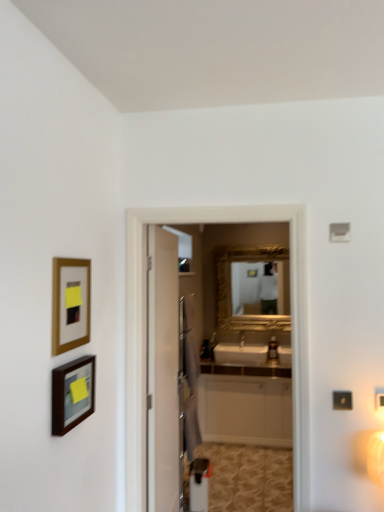
The height and width of the screenshot is (512, 384). What do you see at coordinates (72, 394) in the screenshot? I see `matte black picture frame at lower left, arranged as the first picture frame when ordered from the bottom` at bounding box center [72, 394].

What is the approximate height of white glossy cabinet at center?

The height of white glossy cabinet at center is 31.04 inches.

You are a GUI agent. You are given a task and a screenshot of the screen. Output one action in this format:
    pyautogui.click(x=<x>, y=<y>)
    Task: Click on the white glossy screen door at center
    This screenshot has width=384, height=512.
    Given the screenshot: What is the action you would take?
    pyautogui.click(x=142, y=331)

From a real-world perspective, between white glossy cabinet at center and gold-framed picture at left, which is counted as the 1th picture frame, starting from the top, who is vertically higher?

From a 3D spatial view, gold-framed picture at left, which is counted as the 1th picture frame, starting from the top, is above.

Considering the points (250, 429) and (54, 344), which point is behind, point (250, 429) or point (54, 344)?

The point (250, 429) is farther from the camera.

Is white glossy cabinet at center in contact with gold-framed picture at left, which is counted as the 2th picture frame, starting from the bottom?

There is a gap between white glossy cabinet at center and gold-framed picture at left, which is counted as the 2th picture frame, starting from the bottom.

At what (x,y) coordinates should I click in order to perform the action: click on picture frame that is the 2nd object above the white glossy cabinet at center (from a real-world perspective). Please return your answer as a coordinate pair (x, y). Image resolution: width=384 pixels, height=512 pixels. Looking at the image, I should click on (70, 304).

Would you say white glossy screen door at center is a long distance from white glossy cabinet at center?

white glossy screen door at center is positioned a significant distance from white glossy cabinet at center.

Is white glossy screen door at center oriented away from white glossy cabinet at center?

Correct, white glossy screen door at center is looking away from white glossy cabinet at center.

Can you confirm if white glossy screen door at center is positioned to the left of white glossy cabinet at center?

Correct, you'll find white glossy screen door at center to the left of white glossy cabinet at center.

From a real-world perspective, is white glossy cabinet at center positioned above or below matte black picture frame at lower left, which ranks as the 2th picture frame in top-to-bottom order?

white glossy cabinet at center is situated lower than matte black picture frame at lower left, which ranks as the 2th picture frame in top-to-bottom order, in the real world.

Choose the correct answer: Is white glossy cabinet at center inside matte black picture frame at lower left, arranged as the first picture frame when ordered from the bottom, or outside it?

white glossy cabinet at center cannot be found inside matte black picture frame at lower left, arranged as the first picture frame when ordered from the bottom.

Which object is wider, white glossy cabinet at center or matte black picture frame at lower left, arranged as the first picture frame when ordered from the bottom?

With larger width is white glossy cabinet at center.

Considering the positions of objects white glossy cabinet at center and matte black picture frame at lower left, arranged as the first picture frame when ordered from the bottom, in the image provided, who is more to the right, white glossy cabinet at center or matte black picture frame at lower left, arranged as the first picture frame when ordered from the bottom,?

From the viewer's perspective, white glossy cabinet at center appears more on the right side.

Consider the image. Can you confirm if matte black picture frame at lower left, which ranks as the 2th picture frame in top-to-bottom order, is taller than white glossy cabinet at center?

In fact, matte black picture frame at lower left, which ranks as the 2th picture frame in top-to-bottom order, may be shorter than white glossy cabinet at center.

Considering the relative sizes of matte black picture frame at lower left, which ranks as the 2th picture frame in top-to-bottom order, and white glossy cabinet at center in the image provided, is matte black picture frame at lower left, which ranks as the 2th picture frame in top-to-bottom order, bigger than white glossy cabinet at center?

No.

Is point (82, 367) less distant than point (213, 393)?

Yes, point (82, 367) is closer to viewer.

From a real-world perspective, is matte black picture frame at lower left, which ranks as the 2th picture frame in top-to-bottom order, over white glossy cabinet at center?

Indeed, from a real-world perspective, matte black picture frame at lower left, which ranks as the 2th picture frame in top-to-bottom order, stands above white glossy cabinet at center.

Can you confirm if matte black picture frame at lower left, arranged as the first picture frame when ordered from the bottom, is bigger than gold-framed picture at left, which is counted as the 1th picture frame, starting from the top?

Yes, matte black picture frame at lower left, arranged as the first picture frame when ordered from the bottom, is bigger than gold-framed picture at left, which is counted as the 1th picture frame, starting from the top.

What's the angular difference between matte black picture frame at lower left, which ranks as the 2th picture frame in top-to-bottom order, and gold-framed picture at left, which is counted as the 1th picture frame, starting from the top,'s facing directions?

The angular difference between matte black picture frame at lower left, which ranks as the 2th picture frame in top-to-bottom order, and gold-framed picture at left, which is counted as the 1th picture frame, starting from the top, is 0.734 degrees.

Can you confirm if matte black picture frame at lower left, which ranks as the 2th picture frame in top-to-bottom order, is wider than gold-framed picture at left, which is counted as the 2th picture frame, starting from the bottom?

Correct, the width of matte black picture frame at lower left, which ranks as the 2th picture frame in top-to-bottom order, exceeds that of gold-framed picture at left, which is counted as the 2th picture frame, starting from the bottom.

Can you confirm if gold-framed picture at left, which is counted as the 2th picture frame, starting from the bottom, is shorter than white glossy screen door at center?

Yes, gold-framed picture at left, which is counted as the 2th picture frame, starting from the bottom, is shorter than white glossy screen door at center.

How many degrees apart are the facing directions of gold-framed picture at left, which is counted as the 1th picture frame, starting from the top, and white glossy screen door at center?

The angle between the facing direction of gold-framed picture at left, which is counted as the 1th picture frame, starting from the top, and the facing direction of white glossy screen door at center is 90.7 degrees.

Consider the image. Is gold-framed picture at left, which is counted as the 2th picture frame, starting from the bottom, far from white glossy screen door at center?

gold-framed picture at left, which is counted as the 2th picture frame, starting from the bottom, is actually quite close to white glossy screen door at center.

Which object is thinner, gold-framed picture at left, which is counted as the 2th picture frame, starting from the bottom, or white glossy screen door at center?

gold-framed picture at left, which is counted as the 2th picture frame, starting from the bottom.

Based on the photo, considering the relative sizes of gold-framed picture at left, which is counted as the 2th picture frame, starting from the bottom, and matte black picture frame at lower left, which ranks as the 2th picture frame in top-to-bottom order, in the image provided, is gold-framed picture at left, which is counted as the 2th picture frame, starting from the bottom, shorter than matte black picture frame at lower left, which ranks as the 2th picture frame in top-to-bottom order,?

No.

Is gold-framed picture at left, which is counted as the 2th picture frame, starting from the bottom, next to matte black picture frame at lower left, arranged as the first picture frame when ordered from the bottom?

No, gold-framed picture at left, which is counted as the 2th picture frame, starting from the bottom, is not beside matte black picture frame at lower left, arranged as the first picture frame when ordered from the bottom.

From the image's perspective, which object appears higher, gold-framed picture at left, which is counted as the 2th picture frame, starting from the bottom, or matte black picture frame at lower left, which ranks as the 2th picture frame in top-to-bottom order?

gold-framed picture at left, which is counted as the 2th picture frame, starting from the bottom, appears higher in the image.

Which is closer to the camera, (86, 313) or (67, 408)?

Point (67, 408)

Identify the location of the 1st picture frame in front of the white glossy cabinet at center. (70, 304).

Identify the location of cabinetry below the white glossy screen door at center (from the image's perspective). This screenshot has width=384, height=512. (245, 410).

Considering their positions, is white glossy screen door at center positioned further to matte black picture frame at lower left, which ranks as the 2th picture frame in top-to-bottom order, than gold-framed picture at left, which is counted as the 1th picture frame, starting from the top?

Based on the image, white glossy screen door at center appears to be further to matte black picture frame at lower left, which ranks as the 2th picture frame in top-to-bottom order.

From the image, which object appears to be nearer to matte black picture frame at lower left, arranged as the first picture frame when ordered from the bottom, gold-framed picture at left, which is counted as the 1th picture frame, starting from the top, or white glossy screen door at center?

gold-framed picture at left, which is counted as the 1th picture frame, starting from the top, lies closer to matte black picture frame at lower left, arranged as the first picture frame when ordered from the bottom, than the other object.

Which object lies nearer to the anchor point white glossy screen door at center, white glossy cabinet at center or matte black picture frame at lower left, which ranks as the 2th picture frame in top-to-bottom order?

matte black picture frame at lower left, which ranks as the 2th picture frame in top-to-bottom order, lies closer to white glossy screen door at center than the other object.

Looking at the image, which one is located closer to white glossy cabinet at center, matte black picture frame at lower left, arranged as the first picture frame when ordered from the bottom, or white glossy screen door at center?

white glossy screen door at center.

From the image, which object appears to be nearer to white glossy cabinet at center, white glossy screen door at center or gold-framed picture at left, which is counted as the 2th picture frame, starting from the bottom?

white glossy screen door at center.

Estimate the real-world distances between objects in this image. Which object is further from matte black picture frame at lower left, arranged as the first picture frame when ordered from the bottom, white glossy cabinet at center or gold-framed picture at left, which is counted as the 1th picture frame, starting from the top?

The object further to matte black picture frame at lower left, arranged as the first picture frame when ordered from the bottom, is white glossy cabinet at center.

From the image, which object appears to be farther from white glossy screen door at center, white glossy cabinet at center or gold-framed picture at left, which is counted as the 1th picture frame, starting from the top?

The object further to white glossy screen door at center is white glossy cabinet at center.

From the image, which object appears to be farther from matte black picture frame at lower left, arranged as the first picture frame when ordered from the bottom, white glossy screen door at center or white glossy cabinet at center?

Based on the image, white glossy cabinet at center appears to be further to matte black picture frame at lower left, arranged as the first picture frame when ordered from the bottom.

The height and width of the screenshot is (512, 384). What are the coordinates of `picture frame located between matte black picture frame at lower left, arranged as the first picture frame when ordered from the bottom, and white glossy cabinet at center in the depth direction` in the screenshot? It's located at (70, 304).

This screenshot has height=512, width=384. In order to click on screen door between matte black picture frame at lower left, arranged as the first picture frame when ordered from the bottom, and white glossy cabinet at center in the front-back direction in this screenshot , I will do `click(142, 331)`.

The height and width of the screenshot is (512, 384). I want to click on screen door positioned between gold-framed picture at left, which is counted as the 1th picture frame, starting from the top, and white glossy cabinet at center from near to far, so coord(142,331).

At what (x,y) coordinates should I click in order to perform the action: click on picture frame located between gold-framed picture at left, which is counted as the 1th picture frame, starting from the top, and white glossy screen door at center in the left-right direction. Please return your answer as a coordinate pair (x, y). Image resolution: width=384 pixels, height=512 pixels. Looking at the image, I should click on (72, 394).